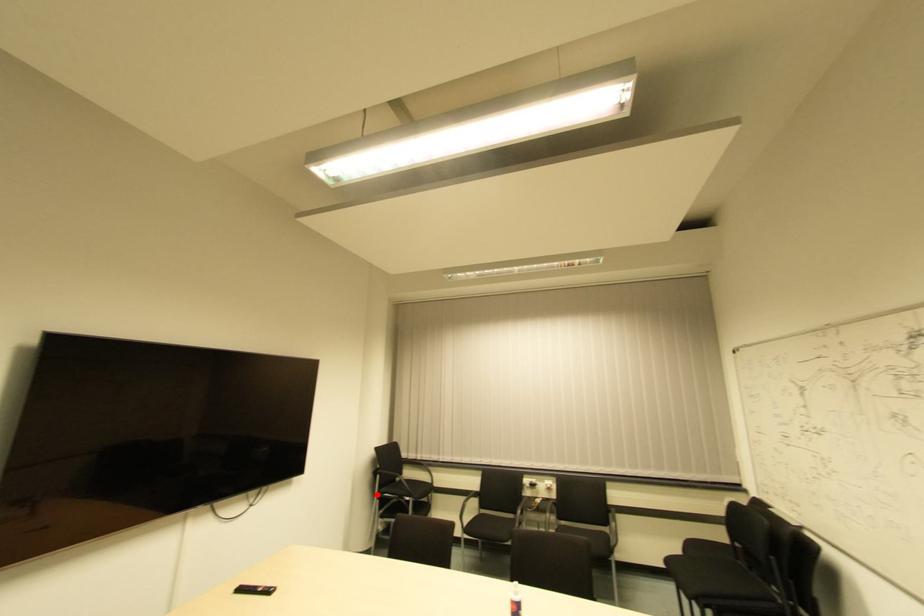
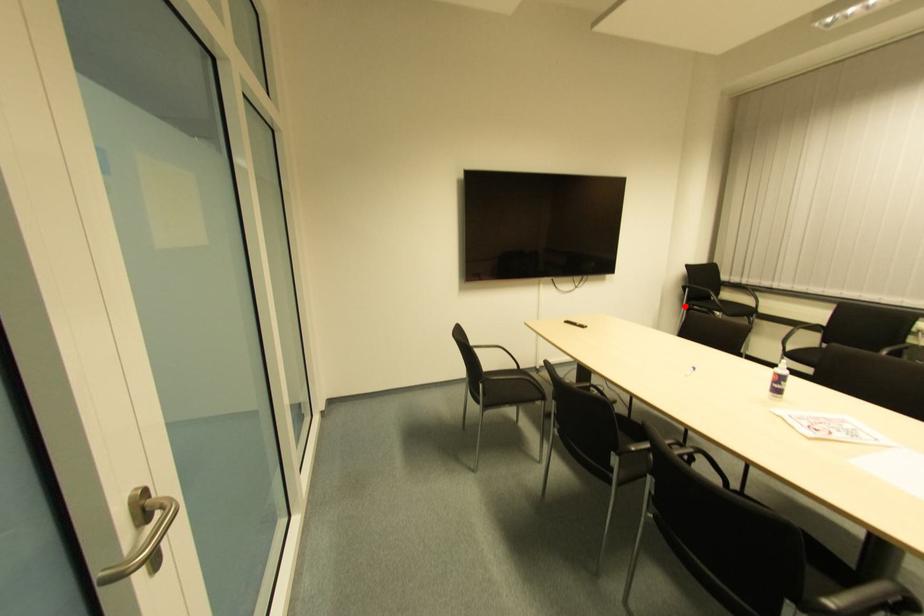
I am providing you with two images of the same scene from different viewpoints. A red point is marked on the first image and another point is marked on the second image. Does the point marked in image1 correspond to the same location as the one in image2?

Yes